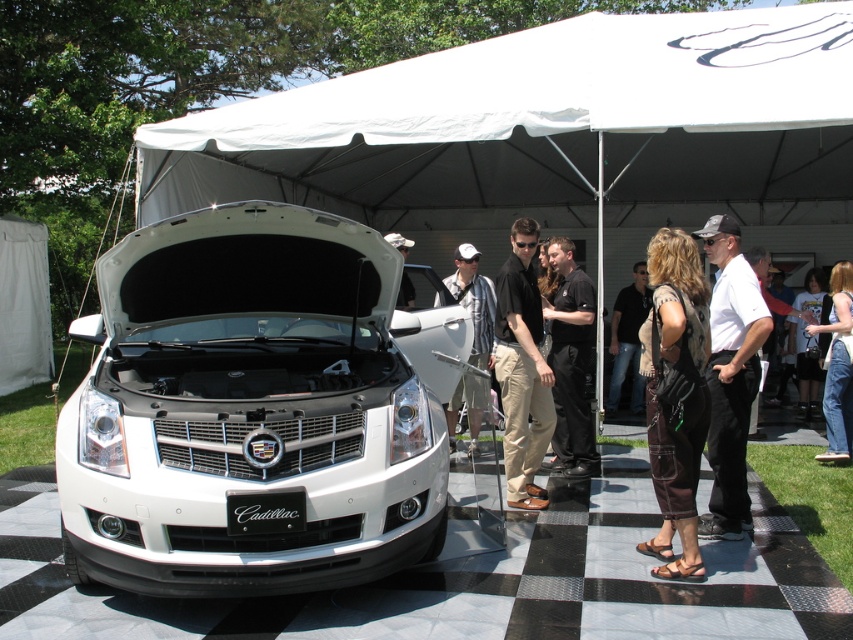
You are standing at the entrance of the car show and see two people wearing denim jeans at lower right and denim shorts at lower right. Which one is closer to you?

The denim jeans at lower right is closer to the viewer than the denim shorts at lower right.